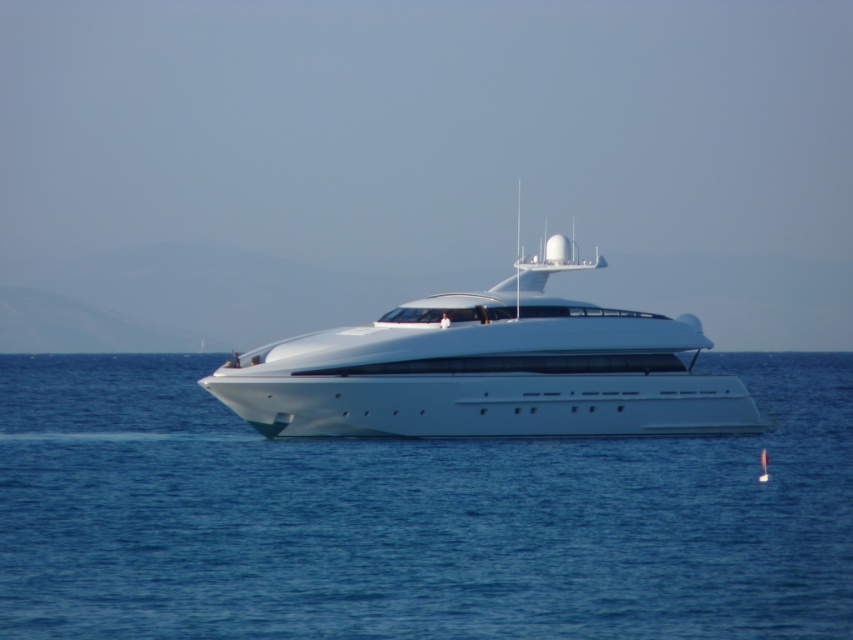
Question: Does white glossy water at center appear on the right side of white glossy yacht at center?

Choices:
 (A) yes
 (B) no

Answer: (B)

Question: Considering the relative positions of white glossy water at center and white glossy yacht at center in the image provided, where is white glossy water at center located with respect to white glossy yacht at center?

Choices:
 (A) below
 (B) above

Answer: (A)

Question: Which point is farther to the camera?

Choices:
 (A) (148, 410)
 (B) (595, 387)

Answer: (A)

Question: Does white glossy water at center have a larger size compared to white glossy yacht at center?

Choices:
 (A) yes
 (B) no

Answer: (A)